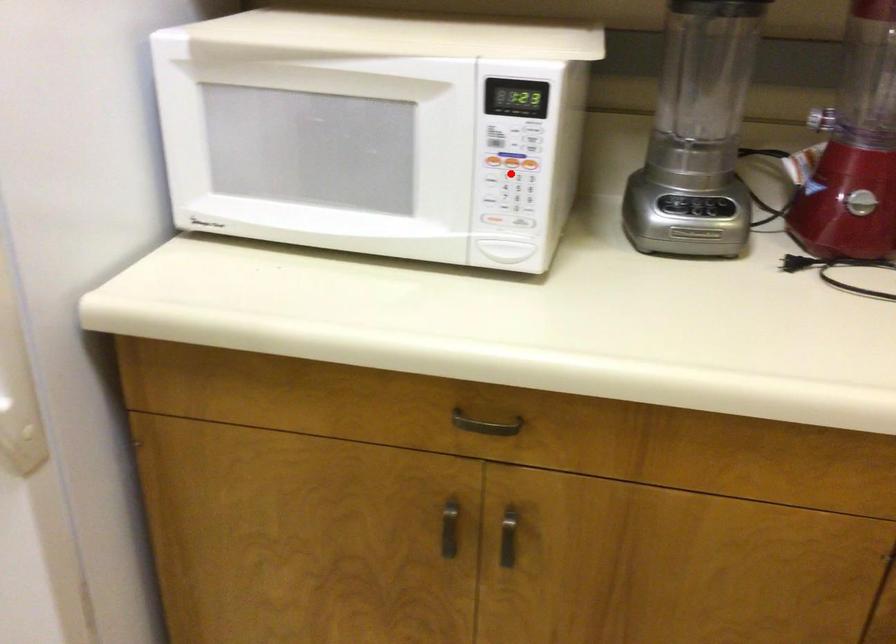
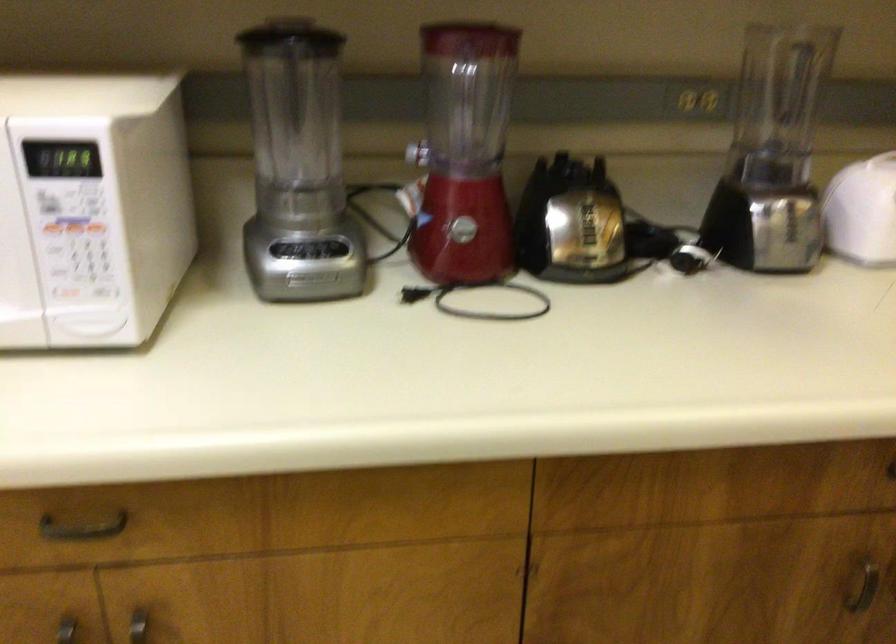
In the second image, find the point that corresponds to the highlighted location in the first image.

(74, 242)